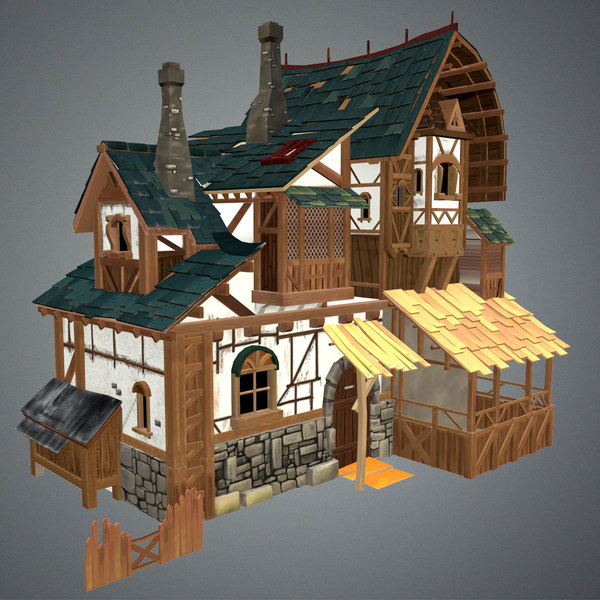
Identify the location of windows. Image resolution: width=600 pixels, height=600 pixels. (119, 236), (139, 408), (258, 388), (445, 180), (414, 184), (362, 210).